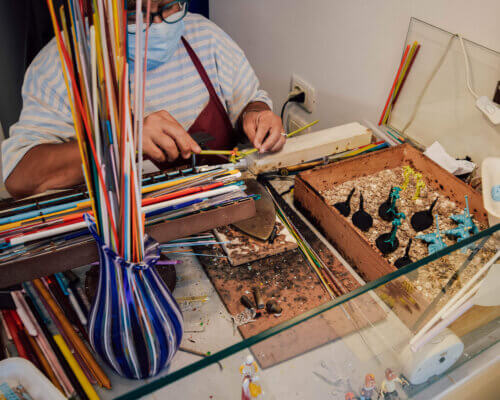
Find the location of a particular element. The image size is (500, 400). socket is located at coordinates (300, 89).